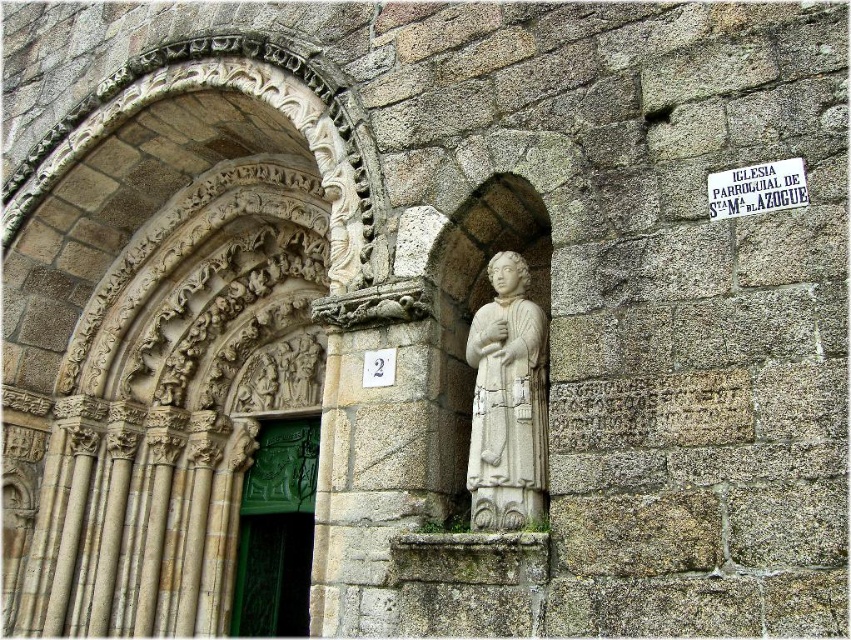
You are an architect examining the historic stone building. You need to determine if the white stone statue at center can be placed on top of the green carved wood door at center. Based on their heights, is this feasible?

The white stone statue at center is shorter than the green carved wood door at center. Since the statue is shorter, it can be placed on top of the door without stability issues.

You are a tour guide leading a group through this historic building. You want to point out the green carved wood door at center and the white paper sign at upper center. Can you clearly see both objects from a distance of 40 meters away?

The distance between the green carved wood door at center and the white paper sign at upper center is 35.16 meters. Since the separation between them is less than 40 meters, they might still be visible individually from that distance, but their details may appear indistinct due to the distance.